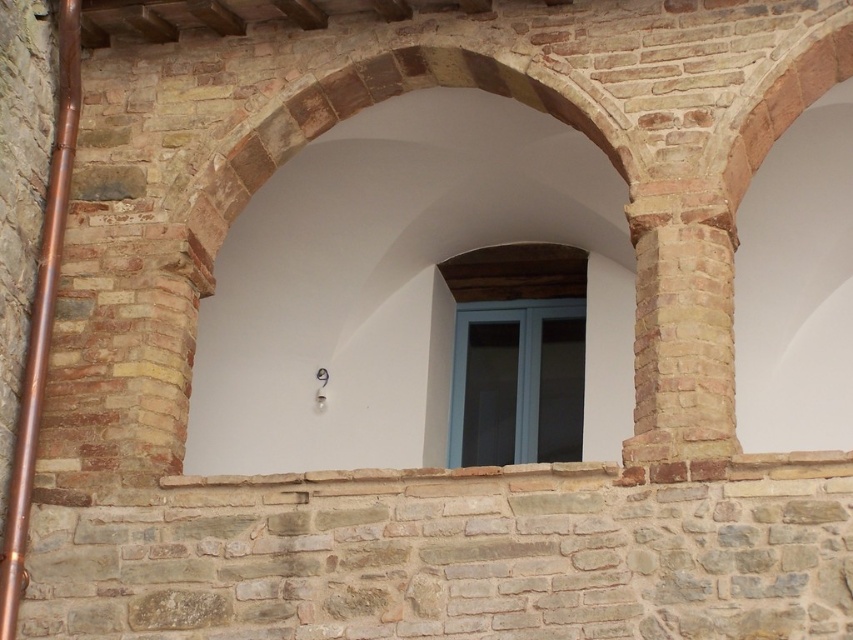
Is smooth stone arch at center in front of brown brick column at right?

No, smooth stone arch at center is further to the viewer.

The width and height of the screenshot is (853, 640). I want to click on smooth stone arch at center, so click(x=387, y=282).

I want to click on smooth stone arch at center, so click(387, 282).

Who is more forward, (653, 262) or (550, 314)?

Point (653, 262) is in front.

Measure the distance between brown brick column at right and blue glass window at center.

A distance of 16.27 meters exists between brown brick column at right and blue glass window at center.

Does point (717, 385) come behind point (526, 330)?

That is False.

Where is `brown brick column at right`? The width and height of the screenshot is (853, 640). brown brick column at right is located at coordinates (682, 323).

Does smooth stone arch at center have a smaller size compared to blue glass window at center?

Incorrect, smooth stone arch at center is not smaller in size than blue glass window at center.

Is smooth stone arch at center positioned in front of blue glass window at center?

Yes, it is in front of blue glass window at center.

Who is more distant from viewer, (x=384, y=176) or (x=572, y=420)?

Point (x=572, y=420)

Find the location of `smooth stone arch at center`. smooth stone arch at center is located at coordinates (387, 282).